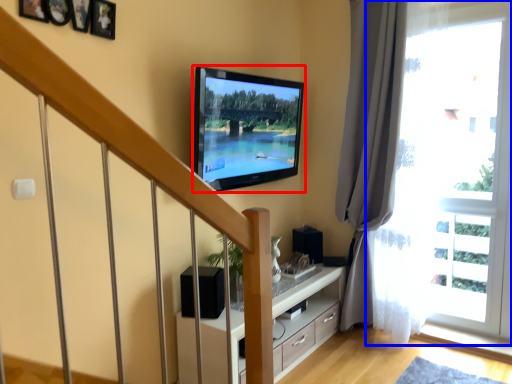
Question: Which object appears farthest to the camera in this image, television (highlighted by a red box) or window (highlighted by a blue box)?

Choices:
 (A) television
 (B) window

Answer: (B)